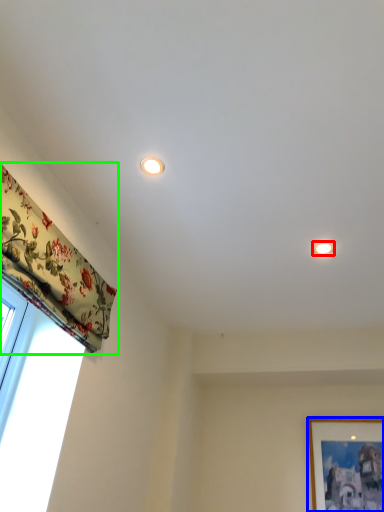
Question: Considering the real-world distances, which object is farthest from lighting (highlighted by a red box)? picture frame (highlighted by a blue box) or curtain (highlighted by a green box)?

Choices:
 (A) picture frame
 (B) curtain

Answer: (A)